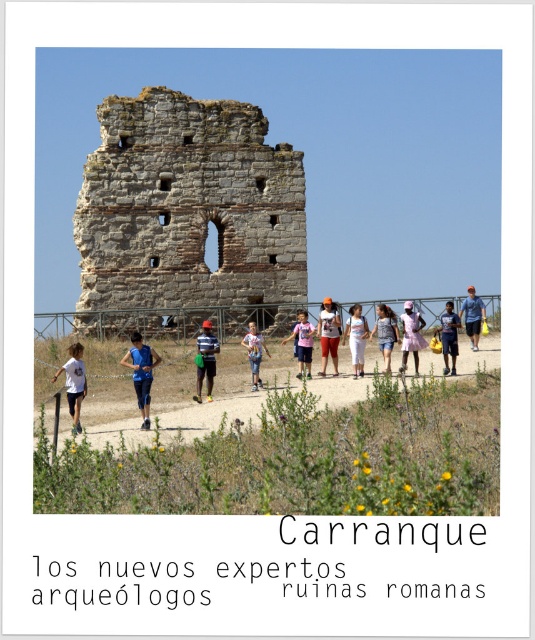
Which is behind, point (447, 333) or point (255, 355)?

Positioned behind is point (447, 333).

Is matte black backpack at center positioned behind white cotton shirt at center?

Yes, it is.

Where is `matte black backpack at center`? matte black backpack at center is located at coordinates (448, 337).

This screenshot has width=535, height=640. What are the coordinates of `matte black backpack at center` in the screenshot? It's located at (448, 337).

Who is positioned more to the right, matte white shorts at center or matte black backpack at center?

Positioned to the right is matte black backpack at center.

Does matte white shorts at center appear on the right side of matte black backpack at center?

No, matte white shorts at center is not to the right of matte black backpack at center.

Between point (338, 321) and point (454, 332), which one is positioned behind?

Positioned behind is point (338, 321).

The width and height of the screenshot is (535, 640). I want to click on matte white shorts at center, so click(x=328, y=333).

Can you confirm if brown dirt path at center is positioned to the left of white cotton dress at center?

Correct, you'll find brown dirt path at center to the left of white cotton dress at center.

Is brown dirt path at center smaller than white cotton dress at center?

Incorrect, brown dirt path at center is not smaller in size than white cotton dress at center.

Is point (185, 380) positioned in front of point (346, 326)?

Yes.

Identify the location of brown dirt path at center. (214, 390).